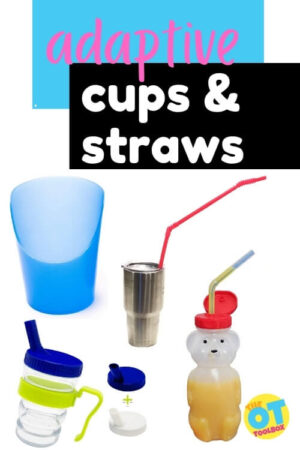
You are a GUI agent. You are given a task and a screenshot of the screen. Output one action in this format:
    pyautogui.click(x=<x>, y=<y>)
    Task: Click on the boxes
    
    Given the screenshot: What is the action you would take?
    [x=251, y=31], [x=260, y=150]